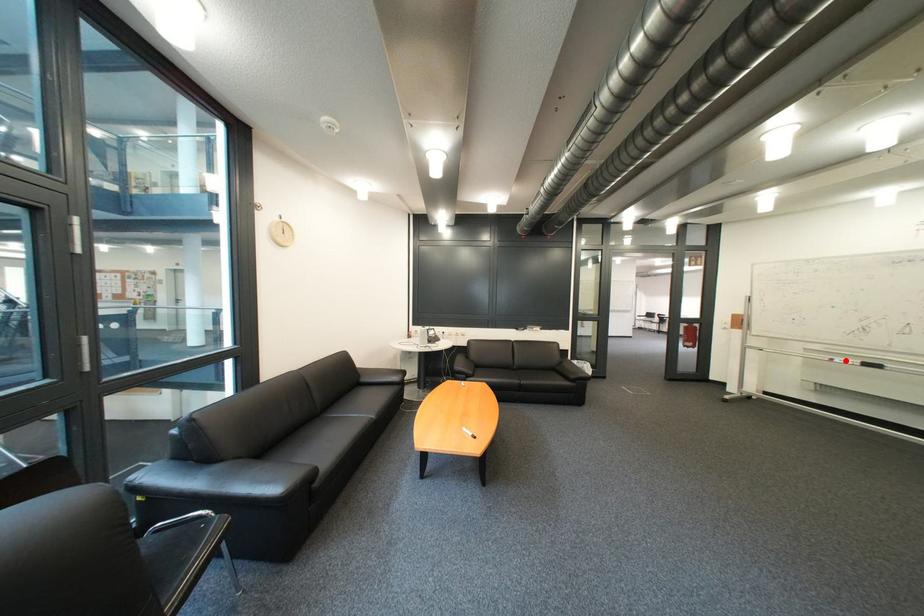
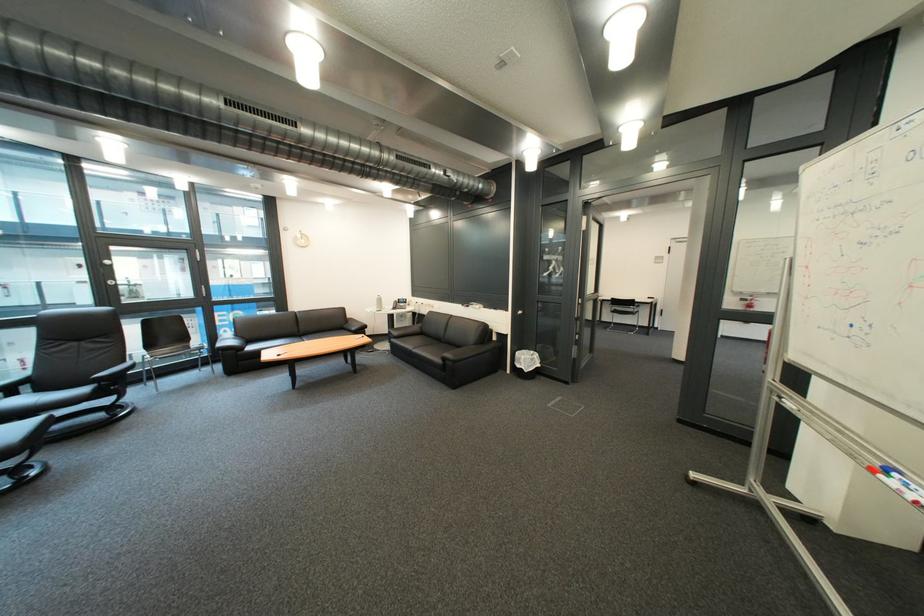
Question: A red point is marked in image1. In image2, is the corresponding 3D point closer to the camera or farther? Reply with the corresponding letter.

Choices:
 (A) The corresponding 3D point is closer.
 (B) The corresponding 3D point is farther.

Answer: (B)